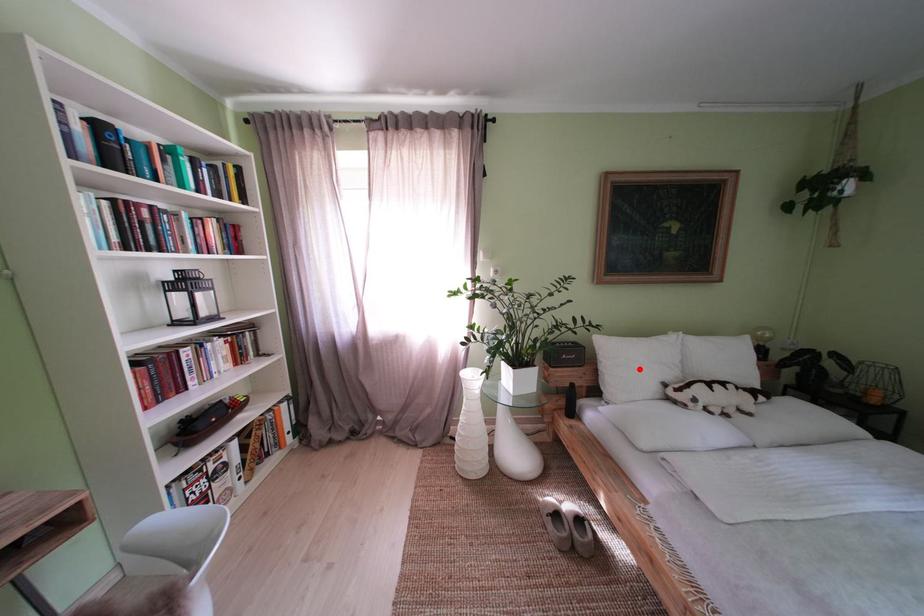
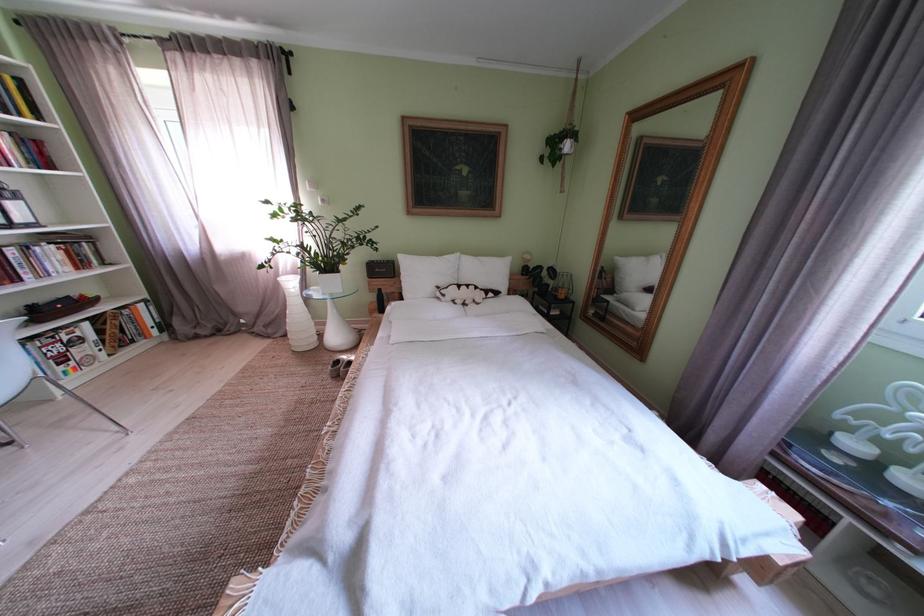
Question: I am providing you with two images of the same scene from different viewpoints. Image1 has a red point marked. In image2, the corresponding 3D location appears at what relative position? Reply with the corresponding letter.

Choices:
 (A) Closer
 (B) Farther

Answer: (A)